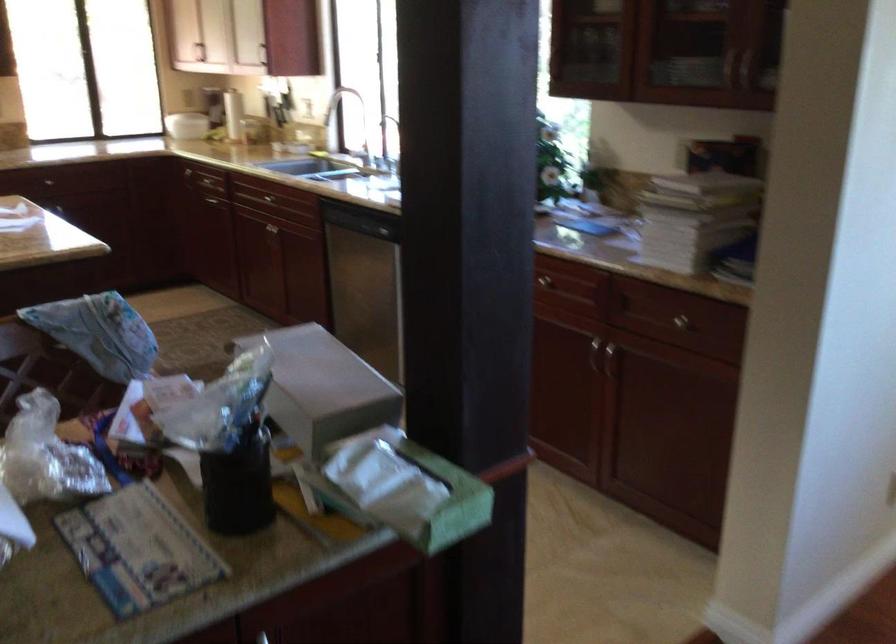
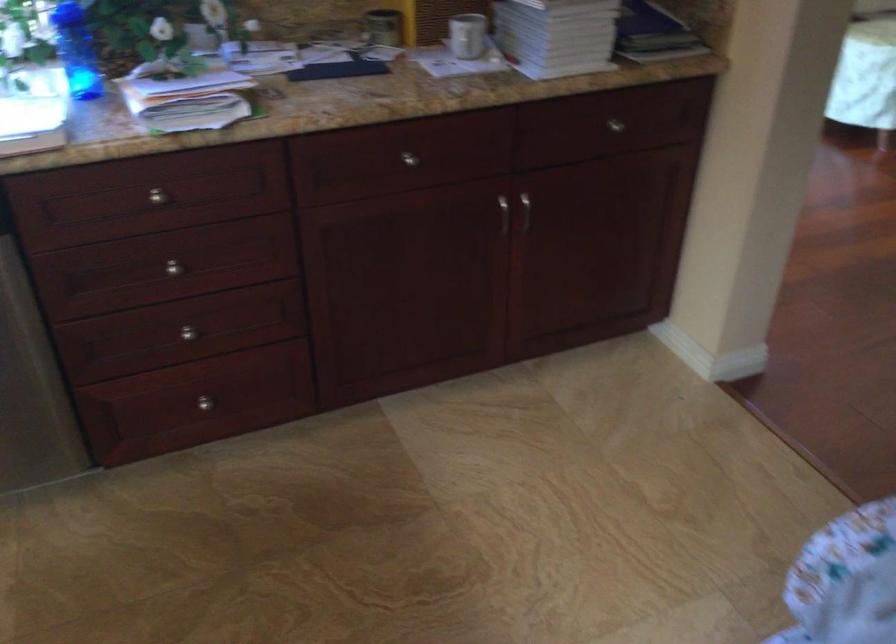
In the second image, find the point that corresponds to point 613,361 in the first image.

(515, 213)